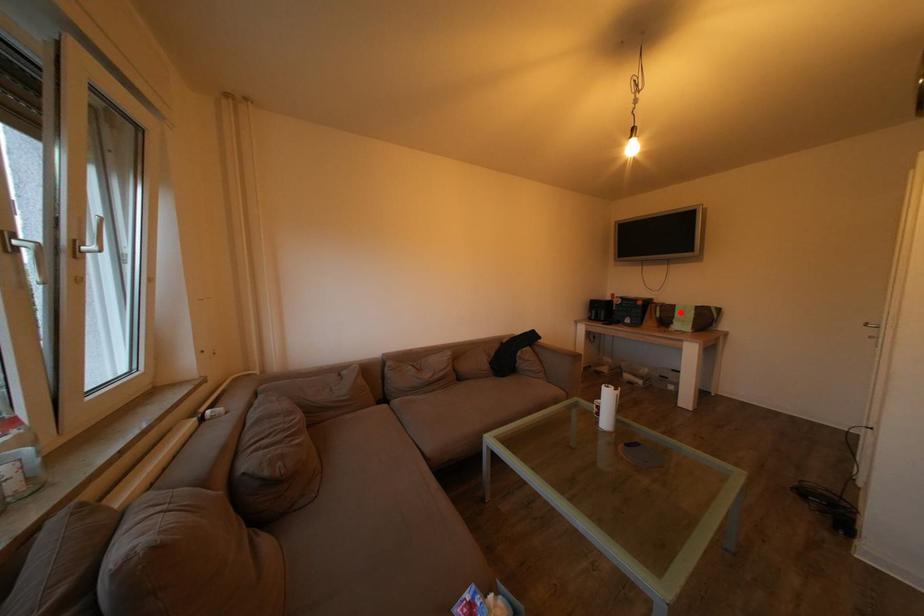
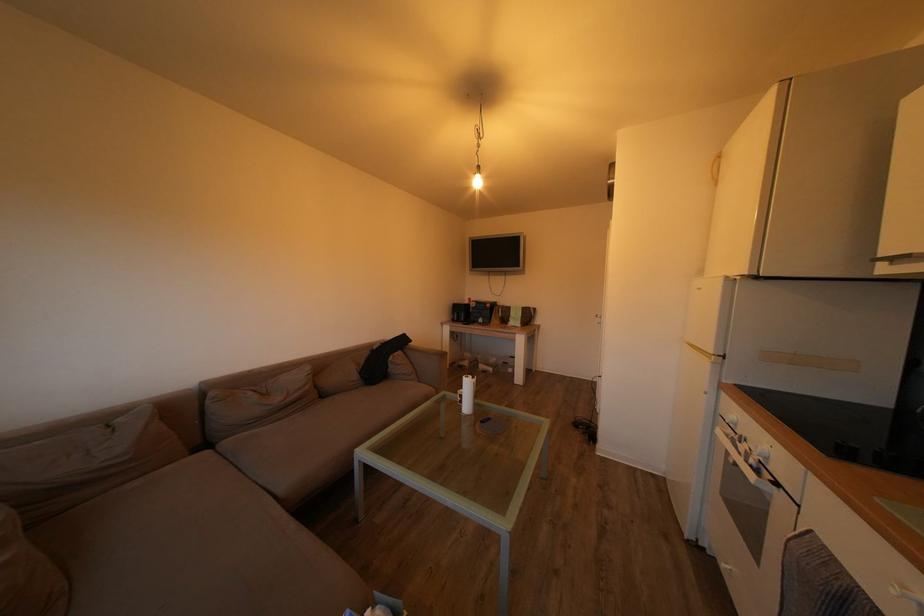
Where in the second image is the point corresponding to the highlighted location from the first image?

(517, 314)